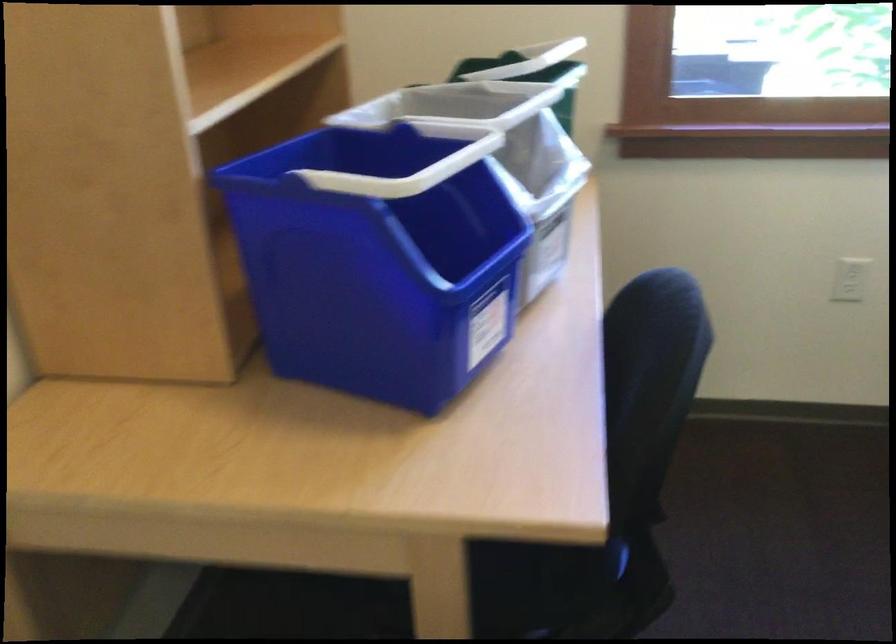
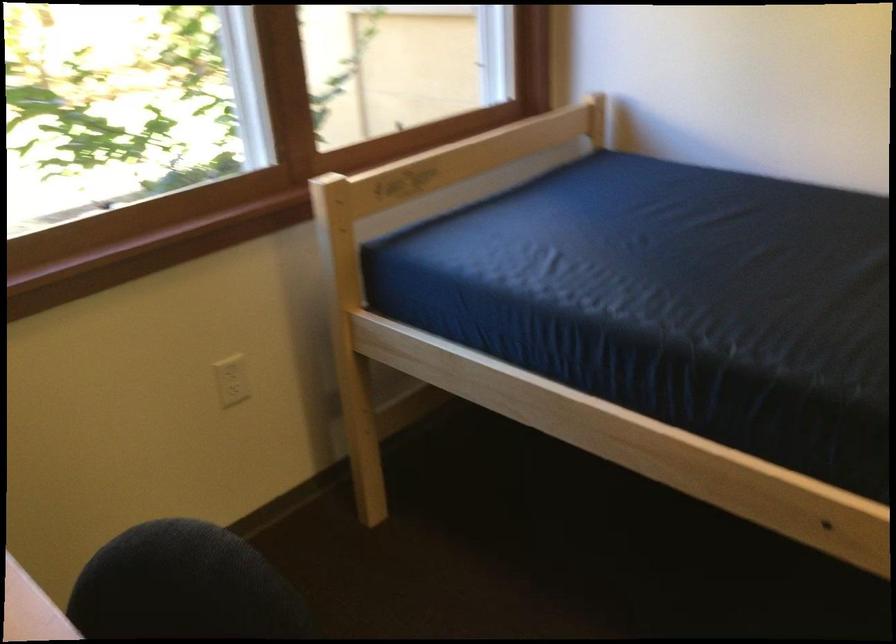
Question: The camera is either moving clockwise (left) or counter-clockwise (right) around the object. The first image is from the beginning of the video and the second image is from the end. Is the camera moving left or right when shooting the video?

Choices:
 (A) Left
 (B) Right

Answer: (A)